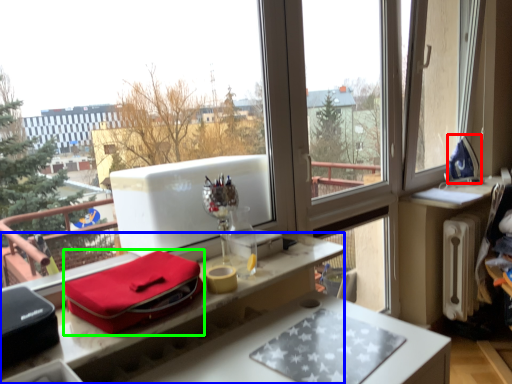
Question: Estimate the real-world distances between objects in this image. Which object is farther from appliance (highlighted by a red box), desk (highlighted by a blue box) or package (highlighted by a green box)?

Choices:
 (A) desk
 (B) package

Answer: (B)